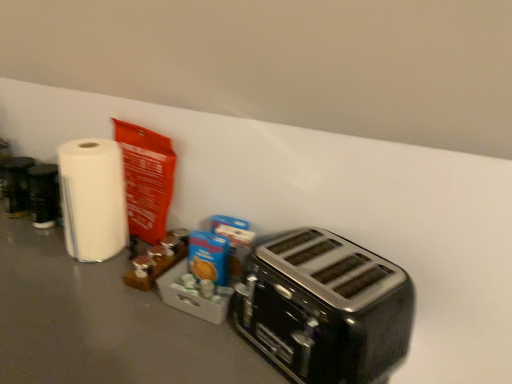
Where is `free spot in front of white glossy paper towel at left`? This screenshot has width=512, height=384. free spot in front of white glossy paper towel at left is located at coordinates (71, 285).